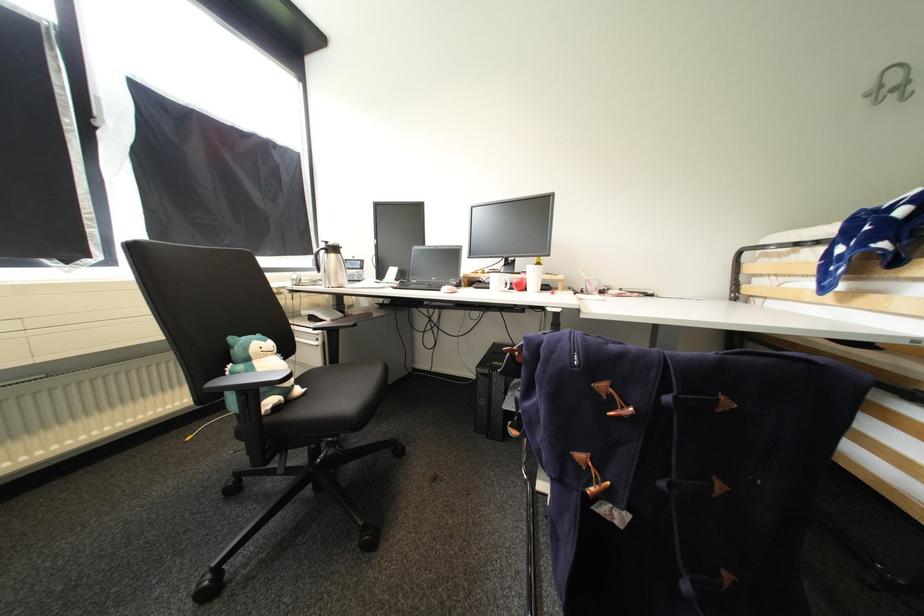
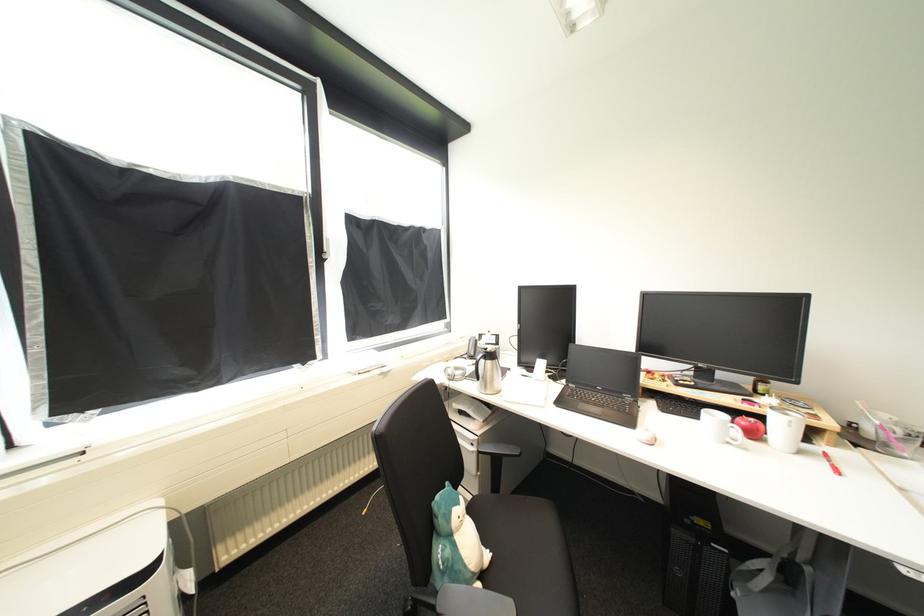
Where in the second image is the point corresponding to (x=302, y=286) from the first image?

(456, 381)